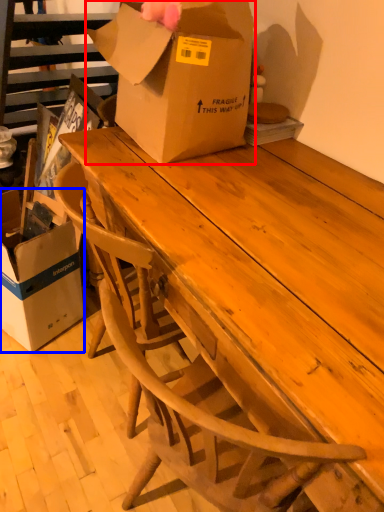
Question: Which point is closer to the camera, box (highlighted by a red box) or box (highlighted by a blue box)?

Choices:
 (A) box
 (B) box

Answer: (A)